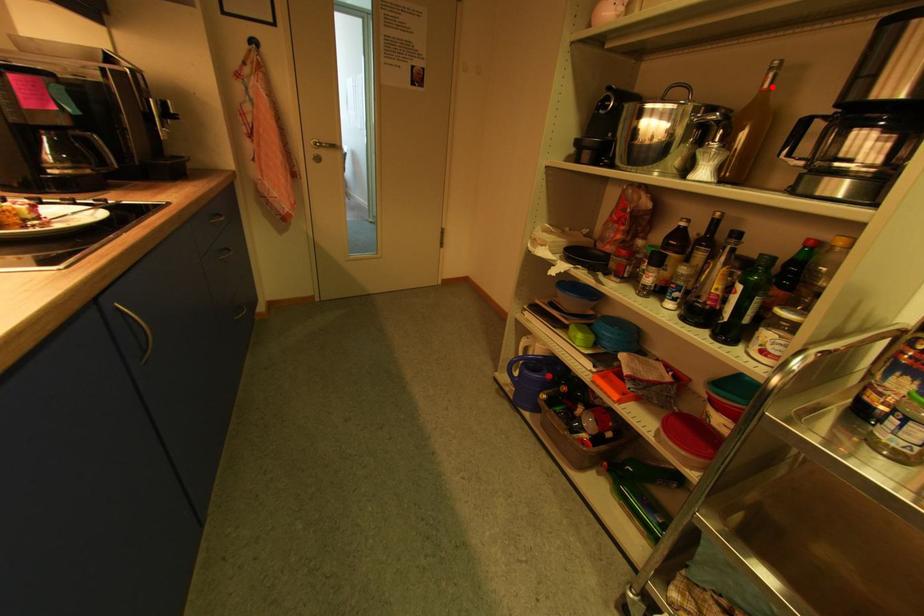
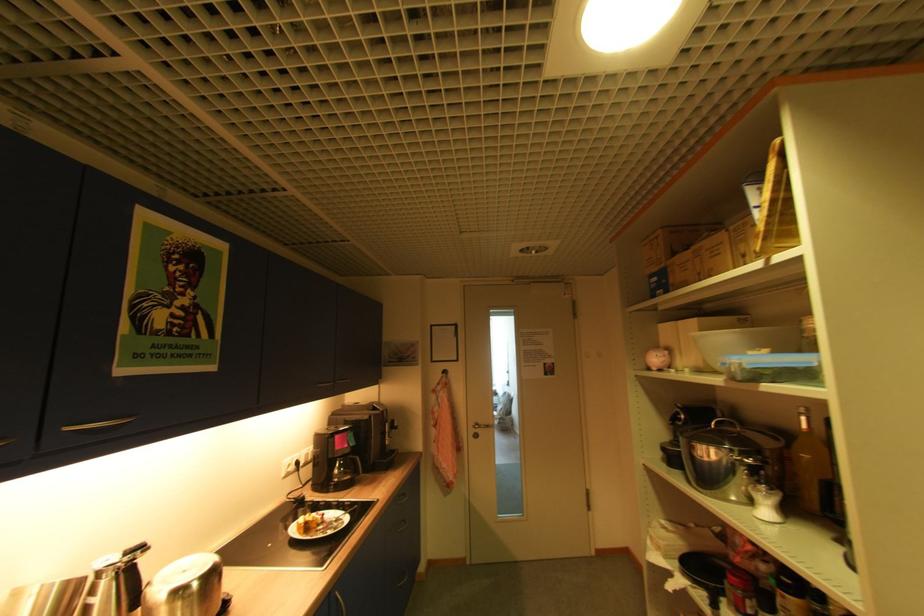
In the second image, find the point that corresponds to the highlighted location in the first image.

(809, 428)